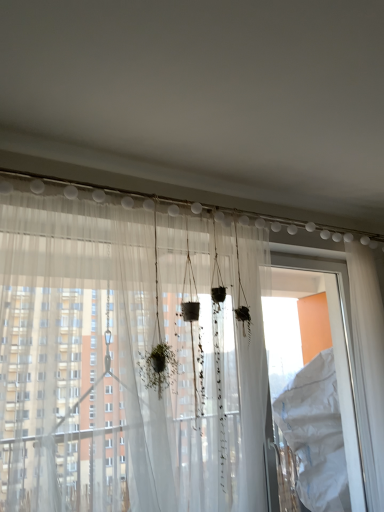
Question: Is translucent fabric curtain at center thinner than translucent fabric at center?

Choices:
 (A) yes
 (B) no

Answer: (B)

Question: Is the depth of translucent fabric curtain at center greater than that of translucent fabric at center?

Choices:
 (A) yes
 (B) no

Answer: (A)

Question: Is translucent fabric at center located within translucent fabric curtain at center?

Choices:
 (A) yes
 (B) no

Answer: (A)

Question: Is translucent fabric curtain at center oriented away from translucent fabric at center?

Choices:
 (A) no
 (B) yes

Answer: (B)

Question: Can you see translucent fabric curtain at center touching translucent fabric at center?

Choices:
 (A) yes
 (B) no

Answer: (B)

Question: Does point (326, 395) appear closer or farther from the camera than point (91, 444)?

Choices:
 (A) closer
 (B) farther

Answer: (B)

Question: From the image's perspective, relative to translucent fabric at center, is white plastic screen door at right above or below?

Choices:
 (A) above
 (B) below

Answer: (B)

Question: From a real-world perspective, is white plastic screen door at right physically located above or below translucent fabric at center?

Choices:
 (A) above
 (B) below

Answer: (B)

Question: Based on their sizes in the image, would you say white plastic screen door at right is bigger or smaller than translucent fabric at center?

Choices:
 (A) big
 (B) small

Answer: (B)

Question: Considering the relative positions of translucent fabric curtain at center and translucent fabric at center in the image provided, is translucent fabric curtain at center to the left or to the right of translucent fabric at center?

Choices:
 (A) right
 (B) left

Answer: (A)

Question: From a real-world perspective, is translucent fabric curtain at center above or below translucent fabric at center?

Choices:
 (A) below
 (B) above

Answer: (A)

Question: From the image's perspective, relative to translucent fabric at center, is translucent fabric curtain at center above or below?

Choices:
 (A) below
 (B) above

Answer: (A)

Question: Is translucent fabric curtain at center wider or thinner than translucent fabric at center?

Choices:
 (A) thin
 (B) wide

Answer: (B)

Question: Is point (314, 441) positioned closer to the camera than point (84, 458)?

Choices:
 (A) farther
 (B) closer

Answer: (A)

Question: From a real-world perspective, relative to translucent fabric curtain at center, is white plastic screen door at right vertically above or below?

Choices:
 (A) below
 (B) above

Answer: (B)